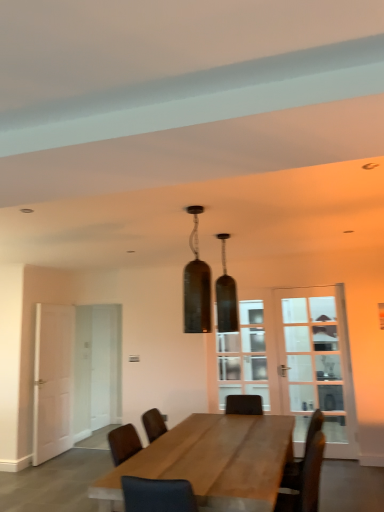
You are a GUI agent. You are given a task and a screenshot of the screen. Output one action in this format:
    pyautogui.click(x=<x>, y=<y>)
    Task: Click on the free space below matte glass pendant light at center, the 2th lamp in the front-to-back sequence (from a real-world perspective)
    The width and height of the screenshot is (384, 512).
    Given the screenshot: What is the action you would take?
    pyautogui.click(x=237, y=418)